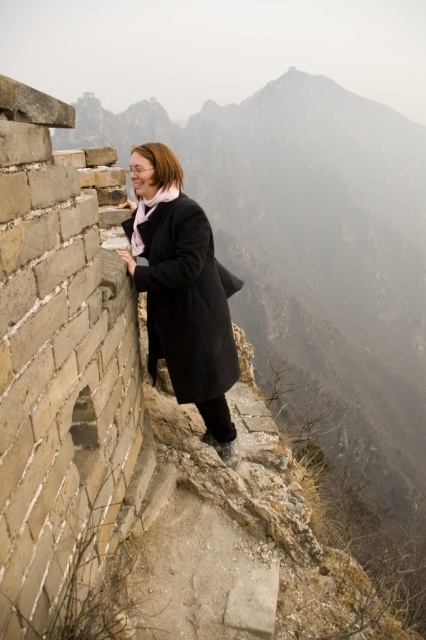
You are a photographer trying to capture the scene of the gray stone wall at left and the matte black coat at left. Based on their positions, which object should you focus on first if you want to frame both in the same shot?

The gray stone wall at left is positioned on the right side of matte black coat at left, so you should focus on the matte black coat at left first to ensure both objects are in frame.

You are standing at the center of the image and want to touch the gray stone wall at left. In which direction should you move to reach it?

You should move to your left to reach the gray stone wall at left since it is located at the left side of the image.